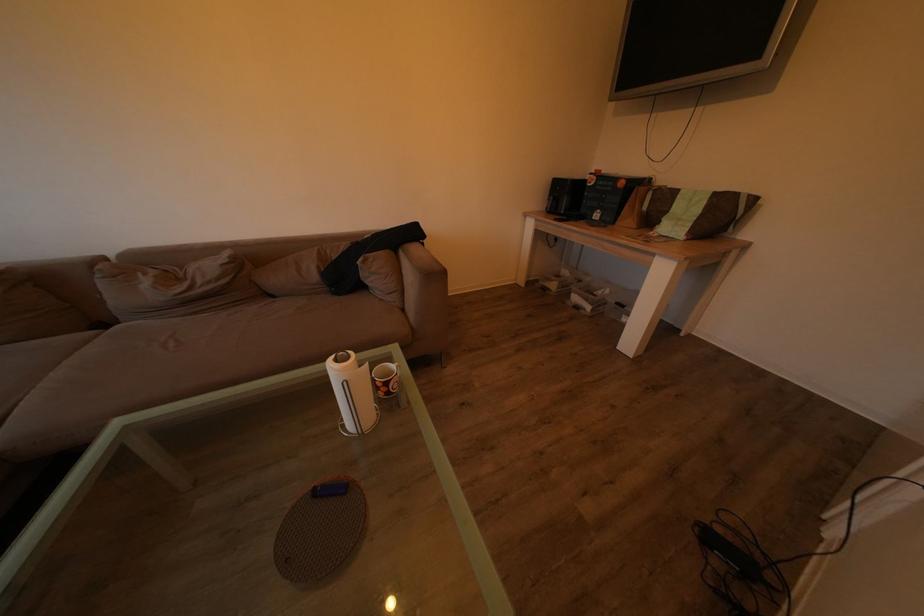
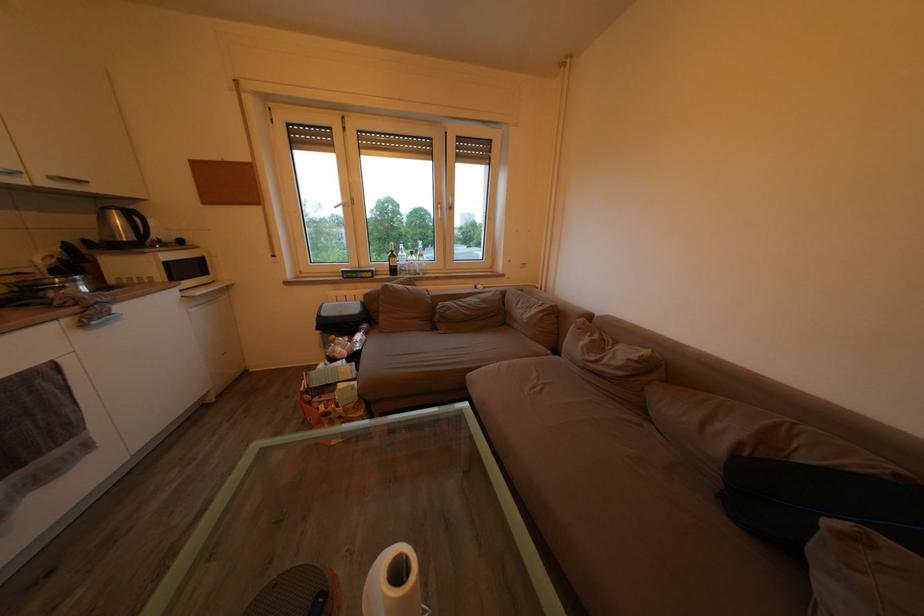
Based on the continuous images, in which direction is the camera rotating?

The rotation direction of the camera is left-down.